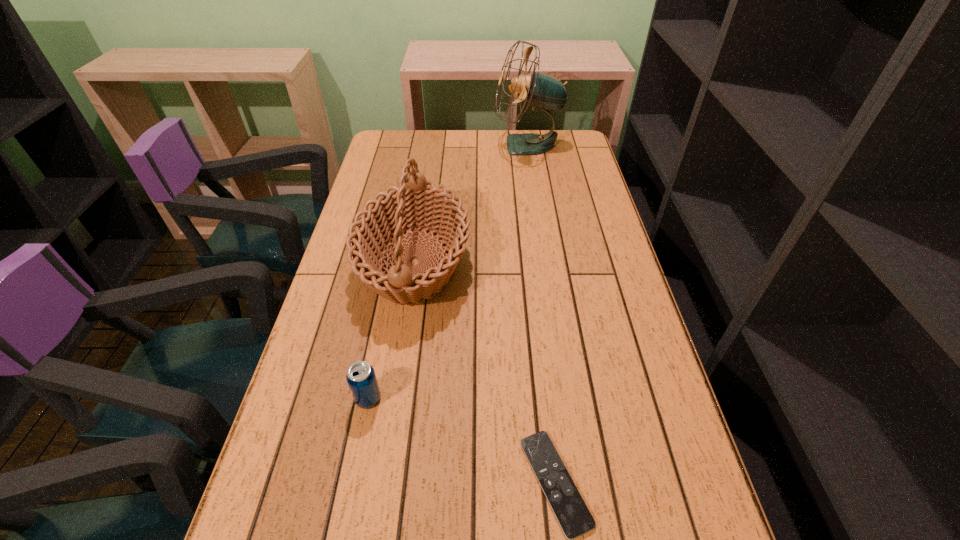
At what (x,y) coordinates should I click in order to perform the action: click on the farthest object. Please return your answer as a coordinate pair (x, y). Looking at the image, I should click on (541, 91).

Locate an element on the screen. The image size is (960, 540). fan is located at coordinates (541, 91).

At what (x,y) coordinates should I click in order to perform the action: click on basket. Please return your answer as a coordinate pair (x, y). The height and width of the screenshot is (540, 960). Looking at the image, I should click on (416, 203).

Identify the location of the third shortest object. The width and height of the screenshot is (960, 540). (416, 203).

Identify the location of the second nearest object. (361, 378).

Identify the location of the third tallest object. (361, 378).

This screenshot has height=540, width=960. I want to click on vacant space situated on the front-facing side of the tallest object for air flow, so click(410, 145).

The width and height of the screenshot is (960, 540). I want to click on vacant space located 0.050m on the front-facing side of the tallest object for air flow, so click(x=480, y=145).

Identify the location of vacant region located 0.070m on the front-facing side of the tallest object for air flow. (475, 145).

Where is `vacant area situated on the back of the second tallest object`? vacant area situated on the back of the second tallest object is located at coordinates (427, 179).